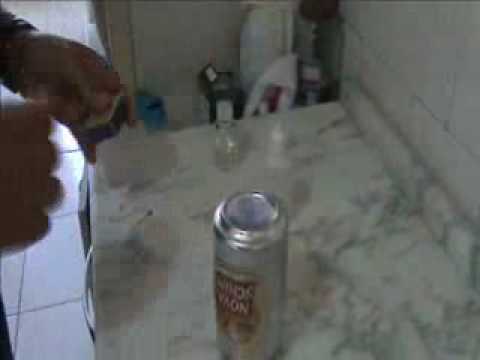
The width and height of the screenshot is (480, 360). I want to click on wall tile, so click(x=443, y=163), click(x=388, y=51), click(x=388, y=82).